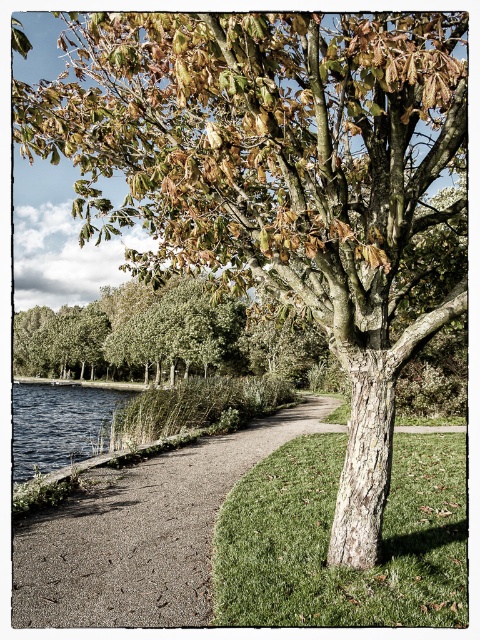
You are standing at the gravel path at center. If you walk straight ahead, will you eventually reach the water or the tree?

The gravel path at center curves gently to the left, so walking straight ahead would lead you away from the tree on the right and towards the water on the other side of the path.

You are standing at the center of the image and want to walk towards the green grass at center. Which direction should you walk?

Since you are already at the center of the image where the green grass at center is located, you don not need to move. You are already at the green grass at center.